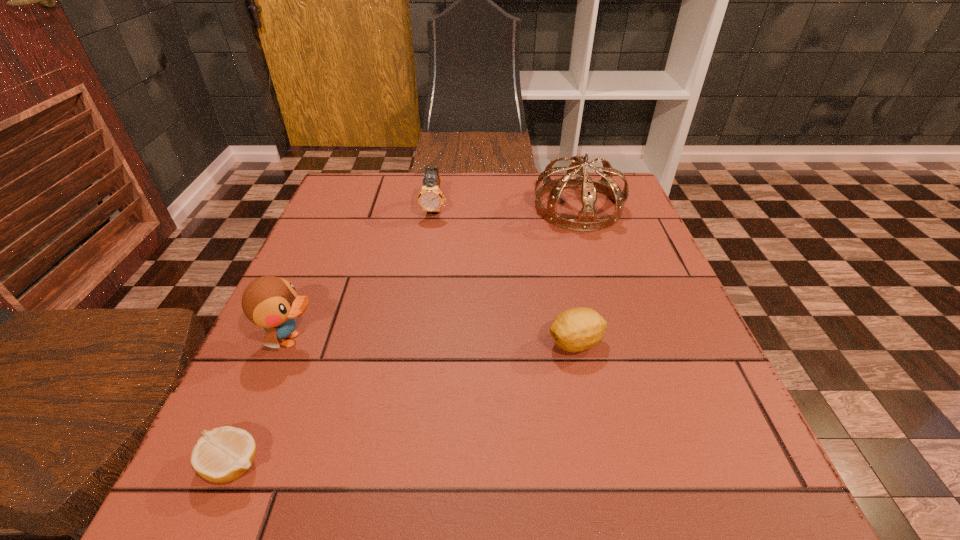
Where is `tiara`? This screenshot has width=960, height=540. tiara is located at coordinates (586, 221).

Locate an element on the screen. This screenshot has height=540, width=960. duck is located at coordinates (270, 302).

Find the location of `the third tallest object`. the third tallest object is located at coordinates (430, 198).

This screenshot has height=540, width=960. I want to click on the third object from left to right, so click(430, 198).

Locate an element on the screen. The image size is (960, 540). the fourth tallest object is located at coordinates (574, 330).

You are a GUI agent. You are given a task and a screenshot of the screen. Output one action in this format:
    pyautogui.click(x=<x>, y=<y>)
    Task: Click on the farther lemon
    The image size is (960, 540).
    Given the screenshot: What is the action you would take?
    tap(574, 330)

Locate an element on the screen. the shorter lemon is located at coordinates 222,455.

Locate an element on the screen. This screenshot has height=540, width=960. the nearest object is located at coordinates (222, 455).

The height and width of the screenshot is (540, 960). What are the coordinates of `free space located on the front of the tiara` in the screenshot? It's located at (597, 268).

At what (x,y) coordinates should I click in order to perform the action: click on vacant space located 0.250m on the front-facing side of the duck. Please return your answer as a coordinate pair (x, y). Looking at the image, I should click on (459, 340).